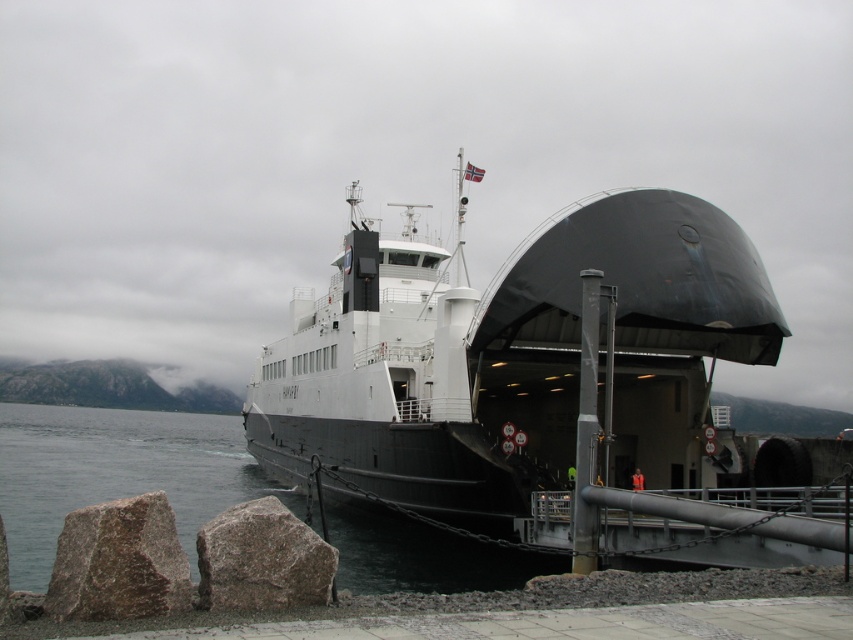
Is clear water at lower left smaller than brown rough rock at lower left?

No, clear water at lower left is not smaller than brown rough rock at lower left.

Can you confirm if clear water at lower left is positioned below brown rough rock at lower left?

Yes.

Is point (138, 468) positioned behind point (53, 577)?

That is True.

Locate an element on the screen. This screenshot has height=640, width=853. clear water at lower left is located at coordinates (115, 472).

Between clear water at lower left and granite rock at lower left, which one has less height?

granite rock at lower left

Between clear water at lower left and granite rock at lower left, which one appears on the right side from the viewer's perspective?

granite rock at lower left

This screenshot has width=853, height=640. In order to click on clear water at lower left in this screenshot , I will do `click(115, 472)`.

Where is `clear water at lower left`? clear water at lower left is located at coordinates (115, 472).

Is black matte ship at center further to the viewer compared to clear water at lower left?

Yes, black matte ship at center is further from the viewer.

Which is behind, point (498, 420) or point (13, 417)?

Point (13, 417)

The height and width of the screenshot is (640, 853). What are the coordinates of `black matte ship at center` in the screenshot? It's located at (512, 358).